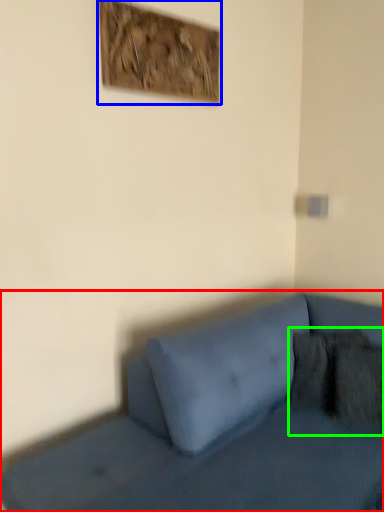
Question: Based on their relative distances, which object is nearer to studio couch (highlighted by a red box)? Choose from picture frame (highlighted by a blue box) and pillow (highlighted by a green box).

Choices:
 (A) picture frame
 (B) pillow

Answer: (B)